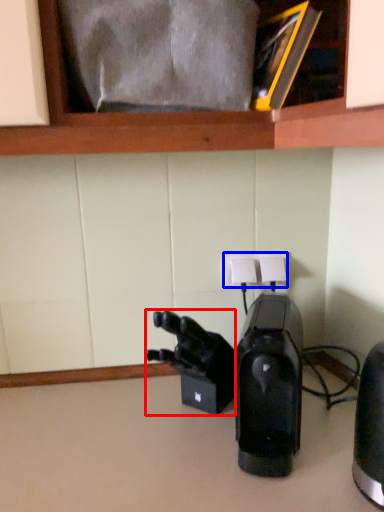
Question: Which object is closer to the camera taking this photo, video camera (highlighted by a red box) or electric outlet (highlighted by a blue box)?

Choices:
 (A) video camera
 (B) electric outlet

Answer: (A)